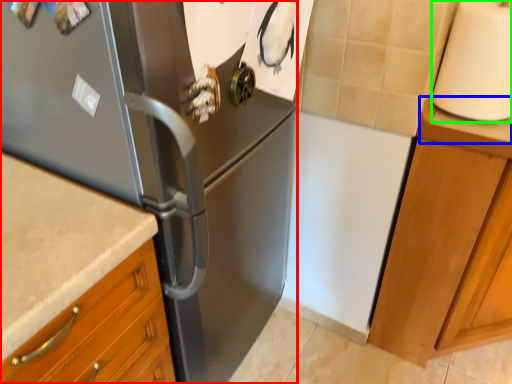
Question: Considering the real-world distances, which object is farthest from refrigerator (highlighted by a red box)? counter top (highlighted by a blue box) or paper towel (highlighted by a green box)?

Choices:
 (A) counter top
 (B) paper towel

Answer: (A)